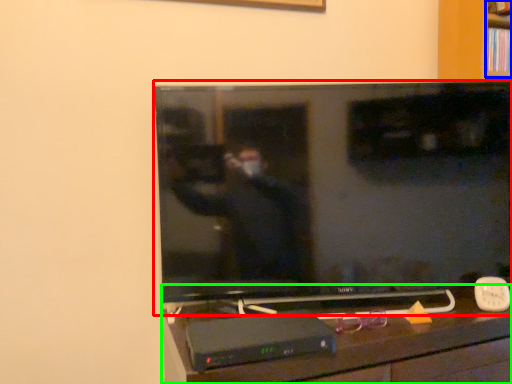
Question: Considering the real-world distances, which object is farthest from television (highlighted by a red box)? shelf (highlighted by a blue box) or furniture (highlighted by a green box)?

Choices:
 (A) shelf
 (B) furniture

Answer: (A)